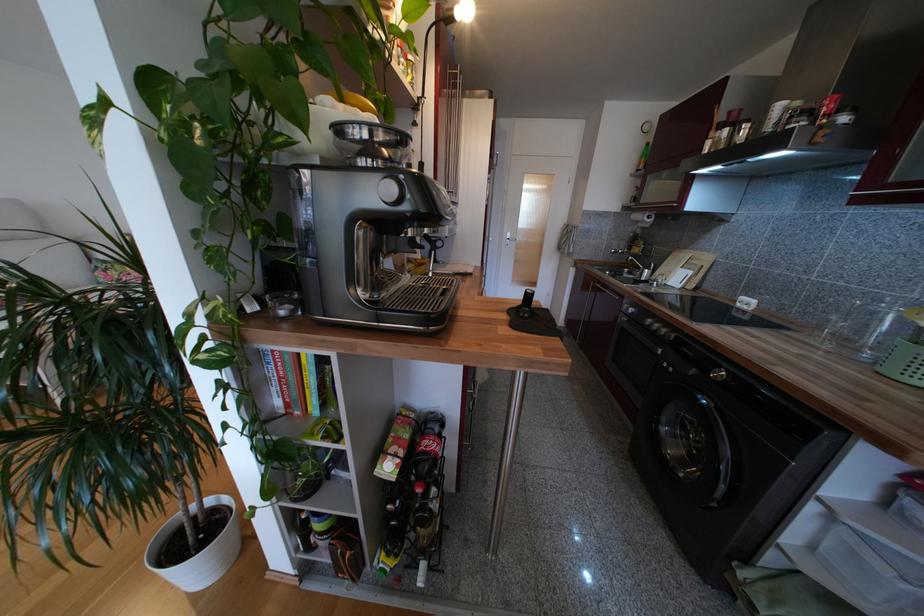
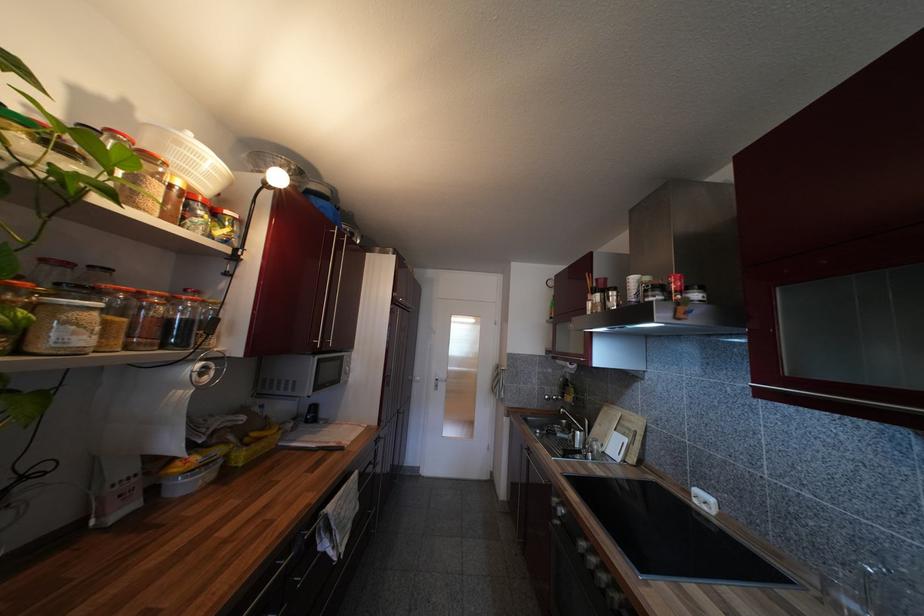
Locate, in the second image, the point that corresponds to point (638, 256) in the first image.

(570, 405)